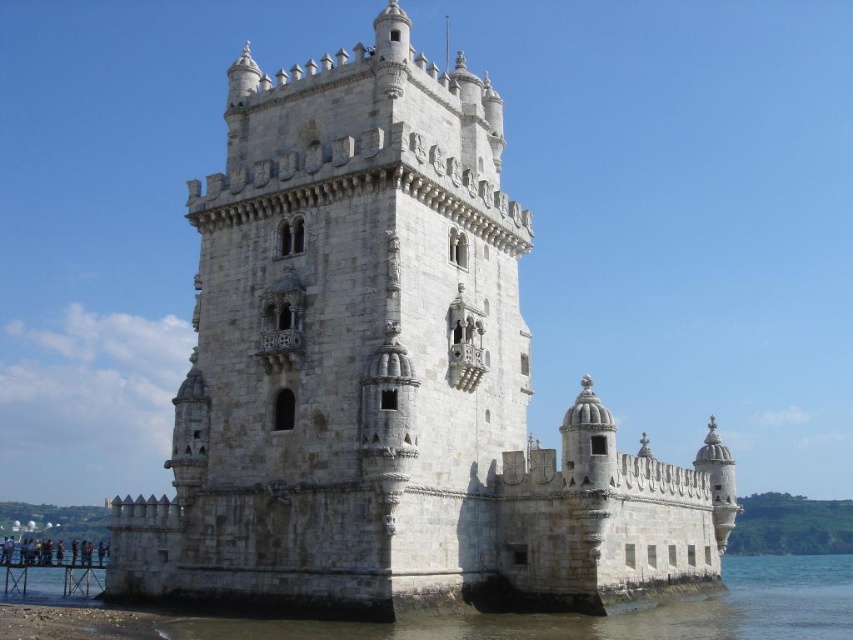
Question: Is white stone castle at center to the left of clear water at lower left from the viewer's perspective?

Choices:
 (A) no
 (B) yes

Answer: (B)

Question: Observing the image, what is the correct spatial positioning of white stone castle at center in reference to clear water at lower left?

Choices:
 (A) right
 (B) left

Answer: (B)

Question: Which object appears farthest from the camera in this image?

Choices:
 (A) white stone castle at center
 (B) clear water at lower left

Answer: (A)

Question: Which point appears closest to the camera in this image?

Choices:
 (A) (521, 621)
 (B) (347, 230)

Answer: (A)

Question: Can you confirm if white stone castle at center is positioned below clear water at lower left?

Choices:
 (A) yes
 (B) no

Answer: (B)